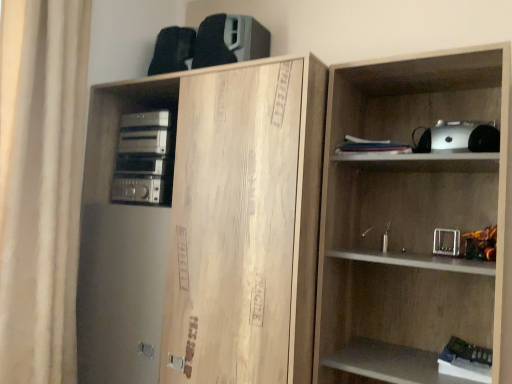
What do you see at coordinates (370, 145) in the screenshot? The height and width of the screenshot is (384, 512). I see `white paper stack at upper center, which is the 1th book in top-to-bottom order` at bounding box center [370, 145].

Find the location of a particular element. wooden shelf at right is located at coordinates (410, 221).

The image size is (512, 384). Describe the element at coordinates (145, 159) in the screenshot. I see `silver metallic stereo at left` at that location.

The height and width of the screenshot is (384, 512). Describe the element at coordinates (466, 361) in the screenshot. I see `white matte book at lower right, the 2th book from the left` at that location.

At what (x,y) coordinates should I click in order to perform the action: click on white paper stack at upper center, which is the first book from left to right. Please return your answer as a coordinate pair (x, y). The width and height of the screenshot is (512, 384). Looking at the image, I should click on (370, 145).

Is white matte book at lower right, marked as the first book in a right-to-left arrangement, facing towards natural wood cabinet at upper left?

No, white matte book at lower right, marked as the first book in a right-to-left arrangement, is not facing towards natural wood cabinet at upper left.

In terms of size, does white matte book at lower right, the 2th book positioned from the top, appear bigger or smaller than natural wood cabinet at upper left?

white matte book at lower right, the 2th book positioned from the top, is smaller than natural wood cabinet at upper left.

Considering the sizes of objects white matte book at lower right, marked as the first book in a right-to-left arrangement, and natural wood cabinet at upper left in the image provided, who is taller, white matte book at lower right, marked as the first book in a right-to-left arrangement, or natural wood cabinet at upper left?

With more height is natural wood cabinet at upper left.

Between white matte book at lower right, the first book in the bottom-to-top sequence, and natural wood cabinet at upper left, which one has larger width?

natural wood cabinet at upper left is wider.

How distant is natural wood cabinet at upper left from silver metallic stereo at left?

natural wood cabinet at upper left and silver metallic stereo at left are 33.78 centimeters apart.

Is natural wood cabinet at upper left positioned with its back to silver metallic stereo at left?

Absolutely, natural wood cabinet at upper left is directed away from silver metallic stereo at left.

Is point (185, 90) farther from camera compared to point (170, 192)?

That is False.

Between natural wood cabinet at upper left and silver metallic stereo at left, which one has smaller width?

Thinner between the two is silver metallic stereo at left.

From the image's perspective, relative to white paper stack at upper center, positioned as the second book in right-to-left order, is natural wood cabinet at upper left above or below?

natural wood cabinet at upper left is situated lower than white paper stack at upper center, positioned as the second book in right-to-left order, in the image.

Considering the relative sizes of natural wood cabinet at upper left and white paper stack at upper center, which is the 1th book in top-to-bottom order, in the image provided, is natural wood cabinet at upper left thinner than white paper stack at upper center, which is the 1th book in top-to-bottom order,?

No, natural wood cabinet at upper left is not thinner than white paper stack at upper center, which is the 1th book in top-to-bottom order.

Find the location of a particular element. book that is above the natural wood cabinet at upper left (from the image's perspective) is located at coordinates (370, 145).

How far apart are white matte book at lower right, the 2th book from the left, and white fabric curtain at left?

white matte book at lower right, the 2th book from the left, is 1.41 meters from white fabric curtain at left.

Considering the positions of objects white matte book at lower right, the 2th book positioned from the top, and white fabric curtain at left in the image provided, who is behind, white matte book at lower right, the 2th book positioned from the top, or white fabric curtain at left?

white fabric curtain at left is further from the camera.

From a real-world perspective, who is located higher, white matte book at lower right, the first book in the bottom-to-top sequence, or white fabric curtain at left?

white fabric curtain at left, from a real-world perspective.

Is the surface of white matte book at lower right, the 2th book from the left, in direct contact with white fabric curtain at left?

No, white matte book at lower right, the 2th book from the left, is not touching white fabric curtain at left.

Between wooden shelf at right and silver metallic stereo at left, which one is positioned in front?

wooden shelf at right is in front.

Is wooden shelf at right oriented towards silver metallic stereo at left?

No, wooden shelf at right is not oriented towards silver metallic stereo at left.

Considering the relative sizes of wooden shelf at right and silver metallic stereo at left in the image provided, is wooden shelf at right wider than silver metallic stereo at left?

Correct, the width of wooden shelf at right exceeds that of silver metallic stereo at left.

Who is bigger, wooden shelf at right or silver metallic stereo at left?

wooden shelf at right.

Looking at this image, how far apart are silver metallic stereo at left and white paper stack at upper center, positioned as the second book in right-to-left order?

A distance of 30.44 inches exists between silver metallic stereo at left and white paper stack at upper center, positioned as the second book in right-to-left order.

The width and height of the screenshot is (512, 384). Find the location of `stereo that appears on the left of white paper stack at upper center, which is the first book from left to right`. stereo that appears on the left of white paper stack at upper center, which is the first book from left to right is located at coordinates (145, 159).

Is silver metallic stereo at left bigger or smaller than white paper stack at upper center, which is the 1th book in top-to-bottom order?

Clearly, silver metallic stereo at left is larger in size than white paper stack at upper center, which is the 1th book in top-to-bottom order.

Does silver metallic stereo at left lie behind white paper stack at upper center, which is the first book from left to right?

Yes, silver metallic stereo at left is further from the viewer.

Consider the image. Does white paper stack at upper center, which is the 1th book in top-to-bottom order, turn towards wooden shelf at right?

Yes.

From a real-world perspective, which is physically below, white paper stack at upper center, positioned as the second book in right-to-left order, or wooden shelf at right?

wooden shelf at right, from a real-world perspective.

Between point (379, 146) and point (355, 286), which one is positioned behind?

The point (355, 286) is farther.

Considering the sizes of objects white paper stack at upper center, which is the 1th book in top-to-bottom order, and wooden shelf at right in the image provided, who is shorter, white paper stack at upper center, which is the 1th book in top-to-bottom order, or wooden shelf at right?

white paper stack at upper center, which is the 1th book in top-to-bottom order, is shorter.

Where is `the 1st book behind the natural wood cabinet at upper left, starting your count from the anchor`? The height and width of the screenshot is (384, 512). the 1st book behind the natural wood cabinet at upper left, starting your count from the anchor is located at coordinates (466, 361).

At what (x,y) coordinates should I click in order to perform the action: click on cabinetry below the silver metallic stereo at left (from a real-world perspective). Please return your answer as a coordinate pair (x, y). This screenshot has height=384, width=512. Looking at the image, I should click on (245, 224).

Estimate the real-world distances between objects in this image. Which object is further from wooden shelf at right, white matte book at lower right, marked as the first book in a right-to-left arrangement, or white fabric curtain at left?

white fabric curtain at left is further to wooden shelf at right.

Which object lies nearer to the anchor point natural wood cabinet at upper left, silver metallic stereo at left or white fabric curtain at left?

The object closer to natural wood cabinet at upper left is silver metallic stereo at left.

From the image, which object appears to be farther from wooden shelf at right, natural wood cabinet at upper left or white paper stack at upper center, the 2th book ordered from the bottom?

white paper stack at upper center, the 2th book ordered from the bottom, is further to wooden shelf at right.

When comparing their distances from white matte book at lower right, marked as the first book in a right-to-left arrangement, does white paper stack at upper center, positioned as the second book in right-to-left order, or white fabric curtain at left seem closer?

white paper stack at upper center, positioned as the second book in right-to-left order, is closer to white matte book at lower right, marked as the first book in a right-to-left arrangement.

From the image, which object appears to be nearer to natural wood cabinet at upper left, white paper stack at upper center, which is the 1th book in top-to-bottom order, or white fabric curtain at left?

The object closer to natural wood cabinet at upper left is white paper stack at upper center, which is the 1th book in top-to-bottom order.

Considering their positions, is natural wood cabinet at upper left positioned further to white fabric curtain at left than white matte book at lower right, marked as the first book in a right-to-left arrangement?

The object further to white fabric curtain at left is white matte book at lower right, marked as the first book in a right-to-left arrangement.

Considering their positions, is white fabric curtain at left positioned further to natural wood cabinet at upper left than silver metallic stereo at left?

Based on the image, white fabric curtain at left appears to be further to natural wood cabinet at upper left.

Looking at the image, which one is located further to white matte book at lower right, the first book in the bottom-to-top sequence, natural wood cabinet at upper left or wooden shelf at right?

natural wood cabinet at upper left is further to white matte book at lower right, the first book in the bottom-to-top sequence.

You are a GUI agent. You are given a task and a screenshot of the screen. Output one action in this format:
    pyautogui.click(x=<x>, y=<y>)
    Task: Click on the book located between white fabric curtain at left and white matte book at lower right, the 2th book positioned from the top, in the left-right direction
    This screenshot has width=512, height=384.
    Given the screenshot: What is the action you would take?
    pyautogui.click(x=370, y=145)

Locate an element on the screen. stereo between white fabric curtain at left and wooden shelf at right is located at coordinates (145, 159).

Find the location of `book between white fabric curtain at left and wooden shelf at right from left to right`. book between white fabric curtain at left and wooden shelf at right from left to right is located at coordinates (370, 145).

This screenshot has height=384, width=512. Find the location of `book located between natural wood cabinet at upper left and white matte book at lower right, the 2th book from the left, in the left-right direction`. book located between natural wood cabinet at upper left and white matte book at lower right, the 2th book from the left, in the left-right direction is located at coordinates (370, 145).